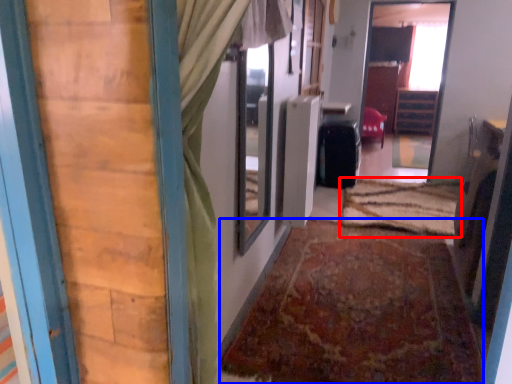
Question: Which of the following is the farthest to the observer, doormat (highlighted by a red box) or doormat (highlighted by a blue box)?

Choices:
 (A) doormat
 (B) doormat

Answer: (A)